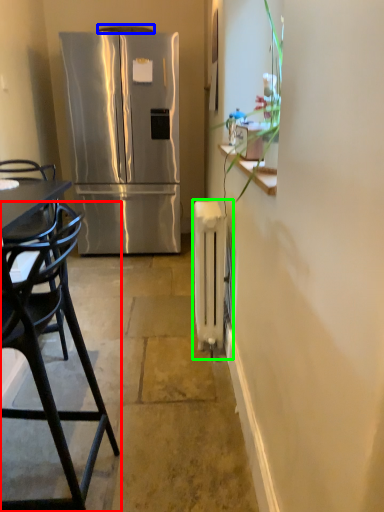
Question: Which is nearer to the chair (highlighted by a red box)? exhaust hood (highlighted by a blue box) or radiator (highlighted by a green box).

Choices:
 (A) exhaust hood
 (B) radiator

Answer: (B)